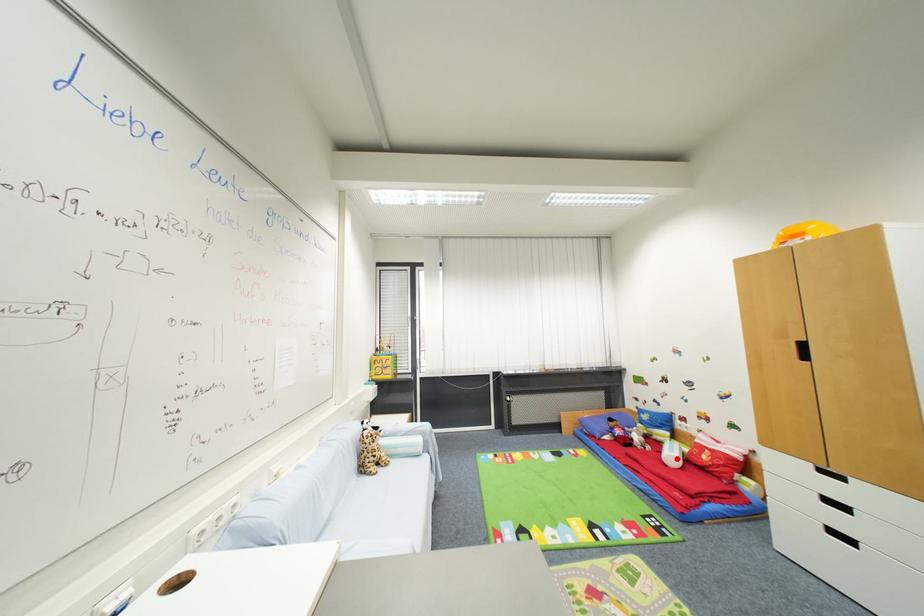
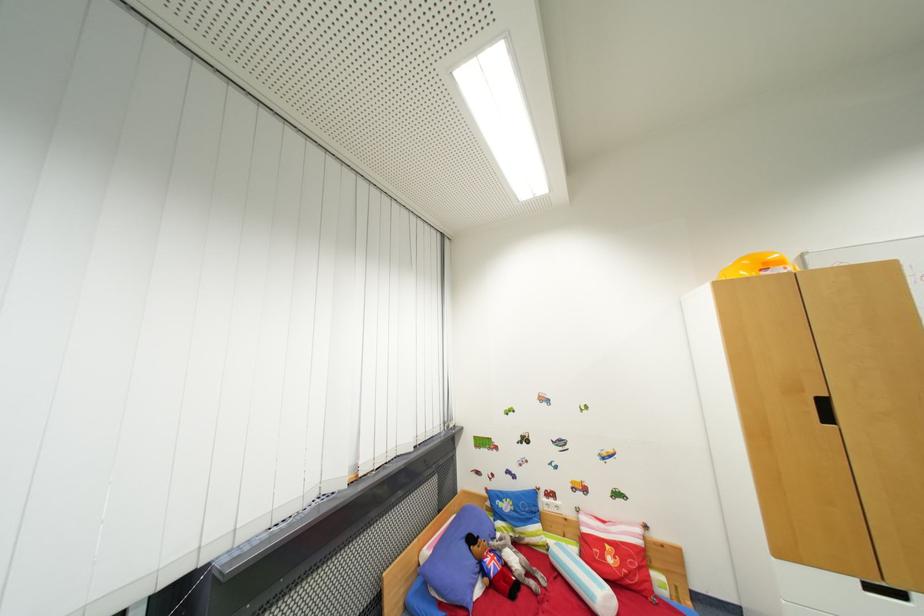
Question: I am providing you with two images of the same scene from different viewpoints. A red point is marked on the first image. Is the red point's position out of view in image 2?

Choices:
 (A) Yes
 (B) No

Answer: (B)